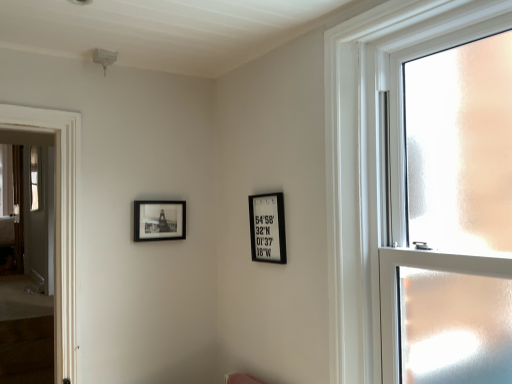
Question: Should I look upward or downward to see black matte picture frame at upper left, the second picture frame viewed from the right?

Choices:
 (A) down
 (B) up

Answer: (A)

Question: Is black matte picture frame at upper left, the second picture frame viewed from the right, thinner than black matte picture frame at upper center, the 2th picture frame viewed from the left?

Choices:
 (A) yes
 (B) no

Answer: (A)

Question: Does black matte picture frame at upper left, which ranks as the first picture frame in left-to-right order, have a greater width compared to black matte picture frame at upper center, the 2th picture frame viewed from the left?

Choices:
 (A) yes
 (B) no

Answer: (B)

Question: Is black matte picture frame at upper left, the second picture frame viewed from the right, positioned in front of black matte picture frame at upper center, the 2th picture frame viewed from the left?

Choices:
 (A) yes
 (B) no

Answer: (B)

Question: Is black matte picture frame at upper left, which ranks as the first picture frame in left-to-right order, positioned with its back to black matte picture frame at upper center, the 2th picture frame viewed from the left?

Choices:
 (A) no
 (B) yes

Answer: (A)

Question: From the image's perspective, is black matte picture frame at upper left, which ranks as the first picture frame in left-to-right order, over black matte picture frame at upper center, positioned as the first picture frame in right-to-left order?

Choices:
 (A) yes
 (B) no

Answer: (A)

Question: Can you confirm if black matte picture frame at upper left, which ranks as the first picture frame in left-to-right order, is positioned to the right of black matte picture frame at upper center, positioned as the first picture frame in right-to-left order?

Choices:
 (A) yes
 (B) no

Answer: (B)

Question: From the image's perspective, does black matte picture frame at upper center, the 2th picture frame viewed from the left, appear higher than black matte picture frame at upper left, the second picture frame viewed from the right?

Choices:
 (A) no
 (B) yes

Answer: (A)

Question: Is black matte picture frame at upper center, the 2th picture frame viewed from the left, at the right side of black matte picture frame at upper left, which ranks as the first picture frame in left-to-right order?

Choices:
 (A) yes
 (B) no

Answer: (A)

Question: From a real-world perspective, does black matte picture frame at upper center, the 2th picture frame viewed from the left, sit lower than black matte picture frame at upper left, which ranks as the first picture frame in left-to-right order?

Choices:
 (A) yes
 (B) no

Answer: (A)

Question: Is black matte picture frame at upper center, the 2th picture frame viewed from the left, taller than black matte picture frame at upper left, the second picture frame viewed from the right?

Choices:
 (A) yes
 (B) no

Answer: (A)

Question: Can you confirm if black matte picture frame at upper center, the 2th picture frame viewed from the left, is wider than black matte picture frame at upper left, which ranks as the first picture frame in left-to-right order?

Choices:
 (A) yes
 (B) no

Answer: (A)

Question: Does black matte picture frame at upper center, the 2th picture frame viewed from the left, lie behind black matte picture frame at upper left, which ranks as the first picture frame in left-to-right order?

Choices:
 (A) no
 (B) yes

Answer: (A)

Question: Is black matte picture frame at upper left, the second picture frame viewed from the right, positioned far away from clear glass window at right?

Choices:
 (A) yes
 (B) no

Answer: (A)